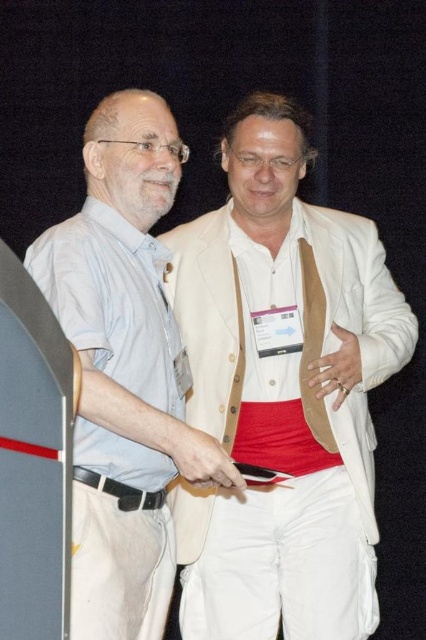
Question: Observing the image, what is the correct spatial positioning of white cotton blazer at center in reference to black leather belt at lower left?

Choices:
 (A) left
 (B) right

Answer: (B)

Question: Which object is positioned closest to the matte light blue shirt at left?

Choices:
 (A) black leather belt at lower left
 (B) white cotton blazer at center

Answer: (A)

Question: Among these points, which one is farthest from the camera?

Choices:
 (A) (351, 353)
 (B) (94, 483)
 (C) (146, 360)

Answer: (A)

Question: Among these objects, which one is nearest to the camera?

Choices:
 (A) black leather belt at lower left
 (B) white cotton blazer at center

Answer: (A)

Question: Is white cotton blazer at center wider than matte light blue shirt at left?

Choices:
 (A) no
 (B) yes

Answer: (B)

Question: Is matte light blue shirt at left to the right of black leather belt at lower left from the viewer's perspective?

Choices:
 (A) yes
 (B) no

Answer: (A)